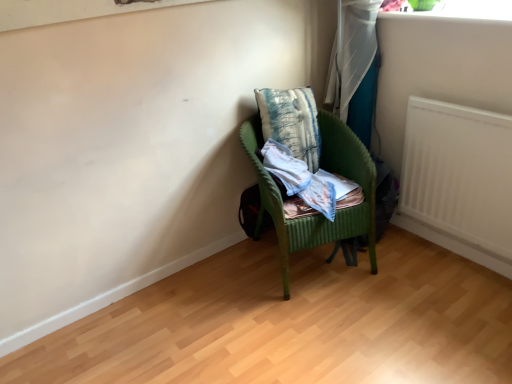
Question: Is there a large distance between light blue cotton shirt at center and white matte radiator at right?

Choices:
 (A) no
 (B) yes

Answer: (A)

Question: Is light blue cotton shirt at center shorter than white matte radiator at right?

Choices:
 (A) yes
 (B) no

Answer: (A)

Question: Is light blue cotton shirt at center in contact with white matte radiator at right?

Choices:
 (A) yes
 (B) no

Answer: (B)

Question: From the image's perspective, is light blue cotton shirt at center under white matte radiator at right?

Choices:
 (A) yes
 (B) no

Answer: (A)

Question: Does light blue cotton shirt at center have a greater height compared to white matte radiator at right?

Choices:
 (A) yes
 (B) no

Answer: (B)

Question: Considering the relative sizes of light blue cotton shirt at center and white matte radiator at right in the image provided, is light blue cotton shirt at center thinner than white matte radiator at right?

Choices:
 (A) yes
 (B) no

Answer: (B)

Question: From a real-world perspective, is green wicker chair at center positioned over white matte radiator at right based on gravity?

Choices:
 (A) yes
 (B) no

Answer: (B)

Question: Is green wicker chair at center not within white matte radiator at right?

Choices:
 (A) no
 (B) yes

Answer: (B)

Question: Does green wicker chair at center touch white matte radiator at right?

Choices:
 (A) yes
 (B) no

Answer: (B)

Question: Considering the relative sizes of green wicker chair at center and white matte radiator at right in the image provided, is green wicker chair at center wider than white matte radiator at right?

Choices:
 (A) yes
 (B) no

Answer: (A)

Question: Could you tell me if green wicker chair at center is facing white matte radiator at right?

Choices:
 (A) no
 (B) yes

Answer: (A)

Question: Can you confirm if green wicker chair at center is thinner than white matte radiator at right?

Choices:
 (A) yes
 (B) no

Answer: (B)

Question: Is textured blue pillow at center oriented away from green wicker chair at center?

Choices:
 (A) yes
 (B) no

Answer: (A)